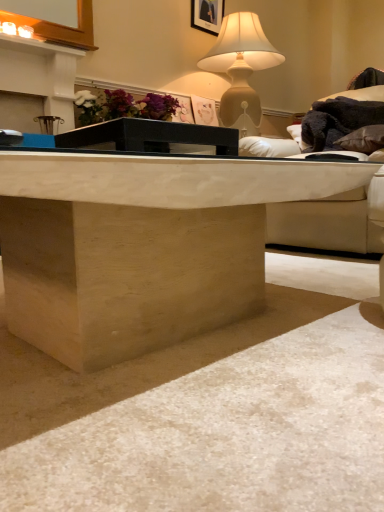
The width and height of the screenshot is (384, 512). Identify the location of matte black picture frame at upper center. (207, 15).

From the picture: Measure the distance between white leather couch at upper right and camera.

white leather couch at upper right is 5.42 feet from camera.

Describe the element at coordinates (326, 224) in the screenshot. This screenshot has width=384, height=512. I see `white leather couch at upper right` at that location.

The height and width of the screenshot is (512, 384). What do you see at coordinates (149, 136) in the screenshot? I see `black glass table at center` at bounding box center [149, 136].

Locate an element on the screen. This screenshot has width=384, height=512. black glass table at center is located at coordinates (149, 136).

Where is `natural wood desk at center`? Image resolution: width=384 pixels, height=512 pixels. natural wood desk at center is located at coordinates (140, 246).

Describe the element at coordinates (363, 140) in the screenshot. I see `brown leather pillow at upper right` at that location.

I want to click on matte black picture frame at upper center, so click(x=207, y=15).

From their relative heights in the image, would you say natural wood desk at center is taller or shorter than brown leather pillow at upper right?

Considering their sizes, natural wood desk at center has more height than brown leather pillow at upper right.

Choose the correct answer: Is natural wood desk at center inside brown leather pillow at upper right or outside it?

natural wood desk at center cannot be found inside brown leather pillow at upper right.

Considering the sizes of objects natural wood desk at center and brown leather pillow at upper right in the image provided, who is smaller, natural wood desk at center or brown leather pillow at upper right?

Smaller between the two is brown leather pillow at upper right.

Based on the photo, from a real-world perspective, which is physically below, natural wood desk at center or brown leather pillow at upper right?

natural wood desk at center is physically lower.

Locate an element on the screen. Image resolution: width=384 pixels, height=512 pixels. table on the left of natural wood desk at center is located at coordinates (149, 136).

What's the angular difference between natural wood desk at center and black glass table at center's facing directions?

The facing directions of natural wood desk at center and black glass table at center are 2.5 degrees apart.

Does point (18, 166) come closer to viewer compared to point (116, 127)?

Yes, it is.

What are the coordinates of `pillow on the right of matte black flowers at upper center` in the screenshot? It's located at (363, 140).

Is matte black flowers at upper center inside brown leather pillow at upper right?

No, matte black flowers at upper center is not inside brown leather pillow at upper right.

From a real-world perspective, between brown leather pillow at upper right and matte black flowers at upper center, who is vertically lower?

brown leather pillow at upper right is physically lower.

Is point (356, 142) in front of point (172, 106)?

Yes.

Is natural wood desk at center not within matte black flowers at upper center?

Indeed, natural wood desk at center is completely outside matte black flowers at upper center.

Which object is more forward, natural wood desk at center or matte black flowers at upper center?

natural wood desk at center is in front.

What's the angular difference between natural wood desk at center and matte black flowers at upper center's facing directions?

The angle between the facing direction of natural wood desk at center and the facing direction of matte black flowers at upper center is 0.287 degrees.

Which point is more distant from viewer, (105, 130) or (136, 116)?

The point (136, 116) is farther.

At what (x,y) coordinates should I click in order to perform the action: click on flower on the left of black glass table at center. Please return your answer as a coordinate pair (x, y). Looking at the image, I should click on (123, 106).

How many degrees apart are the facing directions of black glass table at center and matte black flowers at upper center?

2.79 degrees separate the facing orientations of black glass table at center and matte black flowers at upper center.

Based on the photo, is black glass table at center smaller than natural wood desk at center?

Yes.

Does point (153, 129) lie in front of point (167, 183)?

No, (153, 129) is further to viewer.

Is black glass table at center not close to natural wood desk at center?

No, black glass table at center is in close proximity to natural wood desk at center.

Is black glass table at center positioned beyond the bounds of natural wood desk at center?

Absolutely, black glass table at center is external to natural wood desk at center.

You are a GUI agent. You are given a task and a screenshot of the screen. Output one action in this format:
    pyautogui.click(x=<x>, y=<y>)
    Task: Click on the picture frame above the brown leather pillow at upper right (from a real-world perspective)
    
    Given the screenshot: What is the action you would take?
    pyautogui.click(x=207, y=15)

Is brown leather pillow at upper right positioned far away from matte black picture frame at upper center?

Yes, brown leather pillow at upper right is far from matte black picture frame at upper center.

From the image's perspective, is brown leather pillow at upper right located above matte black picture frame at upper center?

No, from the image's perspective, brown leather pillow at upper right is not on top of matte black picture frame at upper center.

Could matte black picture frame at upper center be considered to be inside brown leather pillow at upper right?

Definitely not — matte black picture frame at upper center is not inside brown leather pillow at upper right.

Image resolution: width=384 pixels, height=512 pixels. Identify the location of pillow lying on the right of natural wood desk at center. (363, 140).

The height and width of the screenshot is (512, 384). What are the coordinates of `table that appears on the left of natural wood desk at center` in the screenshot? It's located at (149, 136).

From the image, which object appears to be nearer to black glass table at center, brown leather pillow at upper right or white leather couch at upper right?

white leather couch at upper right.

In the scene shown: Considering their positions, is brown leather pillow at upper right positioned further to natural wood desk at center than matte black flowers at upper center?

matte black flowers at upper center is further to natural wood desk at center.

Considering their positions, is white leather couch at upper right positioned closer to matte black picture frame at upper center than matte black flowers at upper center?

Based on the image, matte black flowers at upper center appears to be nearer to matte black picture frame at upper center.

Looking at the image, which one is located closer to matte beige lamp at upper center, natural wood desk at center or white leather couch at upper right?

Result: white leather couch at upper right is positioned closer to the anchor matte beige lamp at upper center.

Considering their positions, is matte beige lamp at upper center positioned closer to brown leather pillow at upper right than matte black picture frame at upper center?

matte beige lamp at upper center.

From the image, which object appears to be nearer to matte black picture frame at upper center, white leather couch at upper right or matte beige lamp at upper center?

The object closer to matte black picture frame at upper center is matte beige lamp at upper center.

Estimate the real-world distances between objects in this image. Which object is closer to black glass table at center, brown leather pillow at upper right or natural wood desk at center?

natural wood desk at center is closer to black glass table at center.

Considering their positions, is natural wood desk at center positioned further to matte black picture frame at upper center than matte beige lamp at upper center?

natural wood desk at center is positioned further to the anchor matte black picture frame at upper center.

Where is `pillow located between white leather couch at upper right and matte beige lamp at upper center in the depth direction`? pillow located between white leather couch at upper right and matte beige lamp at upper center in the depth direction is located at coordinates (363, 140).

I want to click on studio couch located between black glass table at center and matte black picture frame at upper center in the depth direction, so click(326, 224).

Identify the location of flower between natural wood desk at center and matte beige lamp at upper center along the z-axis. Image resolution: width=384 pixels, height=512 pixels. [x=123, y=106].

Identify the location of flower between black glass table at center and matte beige lamp at upper center in the front-back direction. (123, 106).